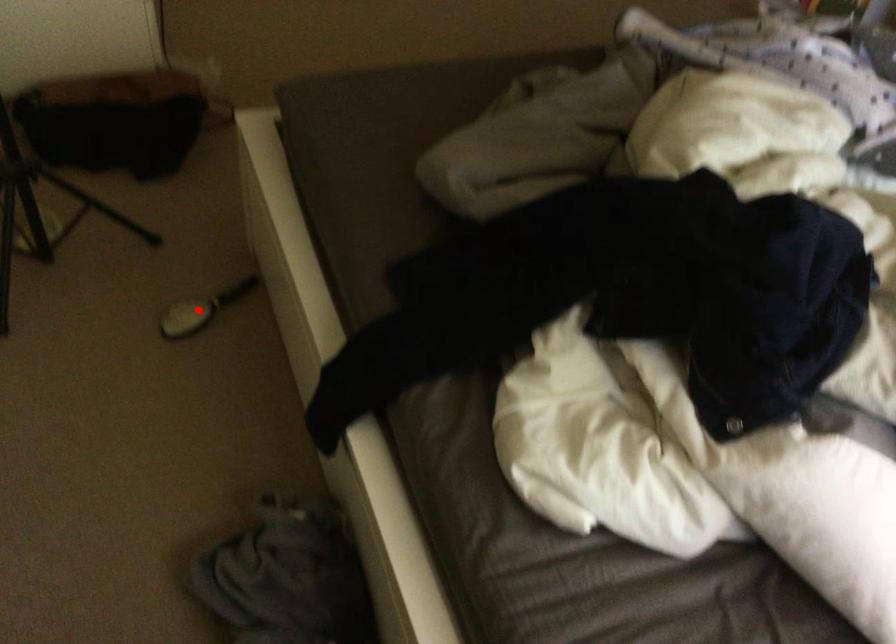
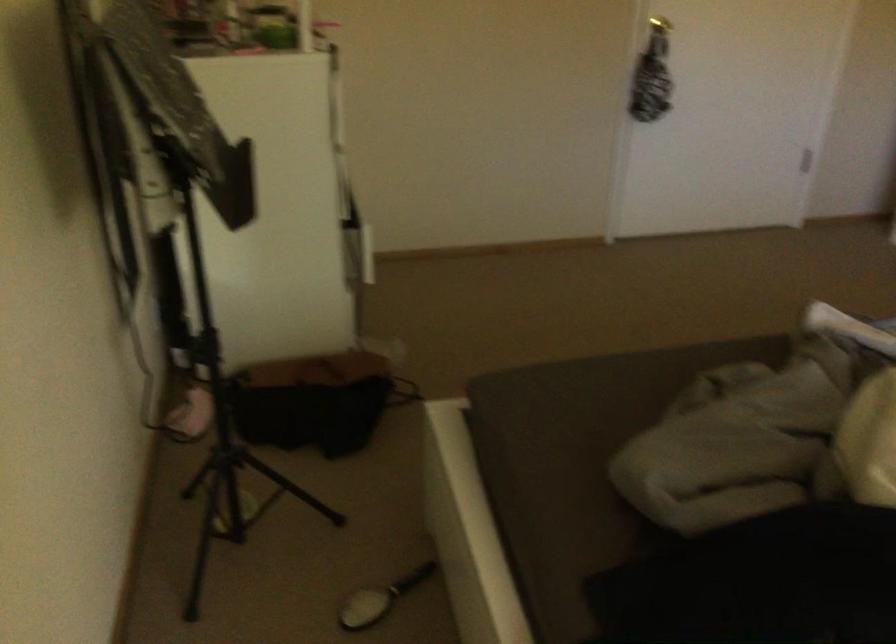
Locate, in the second image, the point that corresponds to the highlighted location in the first image.

(380, 599)